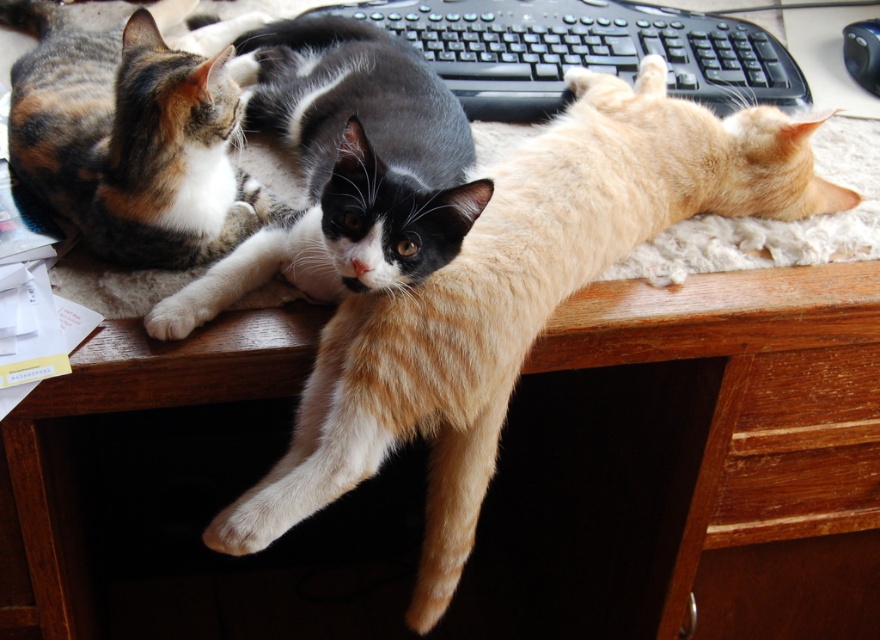
Is calico fur cat at upper left thinner than black plastic keyboard at upper center?

Yes.

Who is more forward, (94, 164) or (672, 54)?

Point (94, 164)

I want to click on calico fur cat at upper left, so click(x=130, y=138).

Consider the image. Does orange tabby cat at center have a greater width compared to calico fur cat at center?

Yes, orange tabby cat at center is wider than calico fur cat at center.

Does orange tabby cat at center have a larger size compared to calico fur cat at center?

Yes.

Does point (291, 518) lie in front of point (317, 180)?

Yes, it is in front of point (317, 180).

I want to click on orange tabby cat at center, so click(x=512, y=301).

Is point (357, 180) positioned in front of point (528, 61)?

Yes.

Is calico fur cat at center bigger than black plastic keyboard at upper center?

Yes, calico fur cat at center is bigger than black plastic keyboard at upper center.

Is point (372, 77) farther from viewer compared to point (510, 67)?

No.

Locate an element on the screen. The height and width of the screenshot is (640, 880). calico fur cat at center is located at coordinates (345, 170).